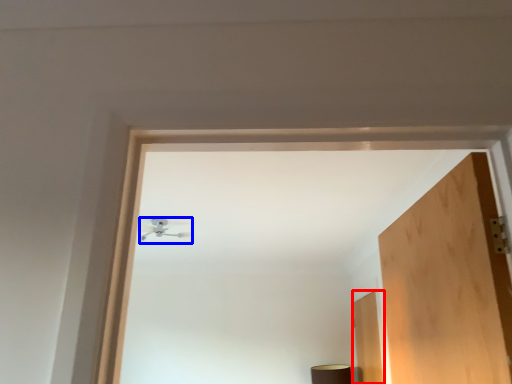
Question: Which of the following is the farthest to the observer, door (highlighted by a red box) or lamp (highlighted by a blue box)?

Choices:
 (A) door
 (B) lamp

Answer: (A)